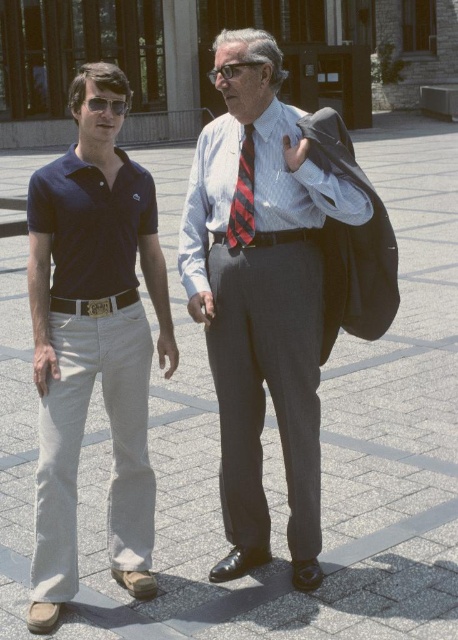
You are a fashion designer who wants to place a new accessory exactly at the center of the matte gray suit at center. According to the coordinates provided, where should you place the accessory?

The accessory should be placed at the coordinates point (261, 304), which is the 2D location of the matte gray suit at center.

You are a photographer setting up for a group photo. You notice the white textured dress shirt at center and the clear plastic glasses at center in your frame. Which object should you adjust to ensure both are centered properly?

The clear plastic glasses at center should be moved to the right to align with the white textured dress shirt at center since the white textured dress shirt at center is currently positioned to the right of the clear plastic glasses at center.